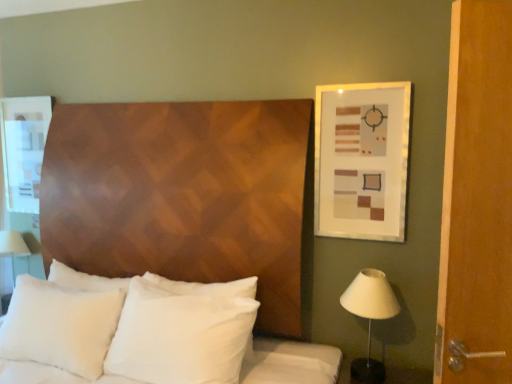
Question: In terms of width, does white fabric table lamp at left look wider or thinner when compared to white soft pillows at center?

Choices:
 (A) thin
 (B) wide

Answer: (A)

Question: Is white fabric table lamp at left in front of or behind white soft pillows at center in the image?

Choices:
 (A) front
 (B) behind

Answer: (B)

Question: Which of these objects is positioned farthest from the white fabric table lamp at left?

Choices:
 (A) matte white picture frame at upper right
 (B) white soft pillows at center
 (C) white soft pillow at center, acting as the 2th pillow starting from the left
 (D) white soft pillow at center, acting as the 1th pillow starting from the left
 (E) white matte lampshade at right

Answer: (E)

Question: Which object is positioned closest to the matte white picture frame at upper right?

Choices:
 (A) white matte lampshade at right
 (B) white soft pillow at center, acting as the 1th pillow starting from the left
 (C) white soft pillows at center
 (D) white soft pillow at center, the first pillow viewed from the right
 (E) white fabric table lamp at left

Answer: (A)